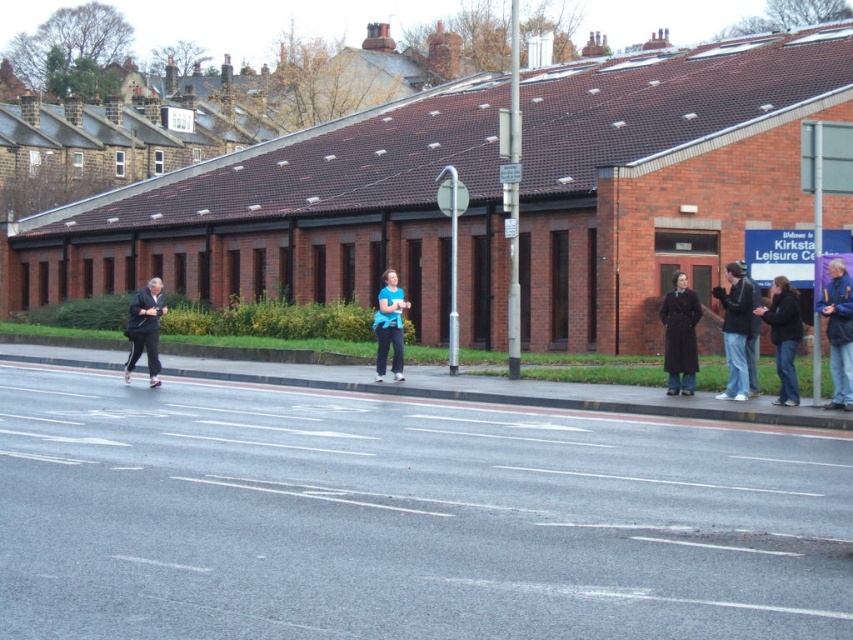
Question: Among these points, which one is nearest to the camera?

Choices:
 (A) (660, 308)
 (B) (764, 284)
 (C) (723, 317)
 (D) (840, 404)

Answer: (D)

Question: Does dark blue jeans at right have a greater width compared to dark brown leather coat at right?

Choices:
 (A) yes
 (B) no

Answer: (B)

Question: Does black plastic bus stop at right have a greater width compared to dark brown leather coat at right?

Choices:
 (A) no
 (B) yes

Answer: (A)

Question: Does dark brown leather coat at right appear on the right side of dark blue jacket at right?

Choices:
 (A) no
 (B) yes

Answer: (A)

Question: Which is farther from the blue denim jacket at right?

Choices:
 (A) black plastic bus stop at right
 (B) dark brown leather coat at right

Answer: (A)

Question: Which object is farther from the camera taking this photo?

Choices:
 (A) black plastic bus stop at right
 (B) blue fabric shirt at center

Answer: (B)